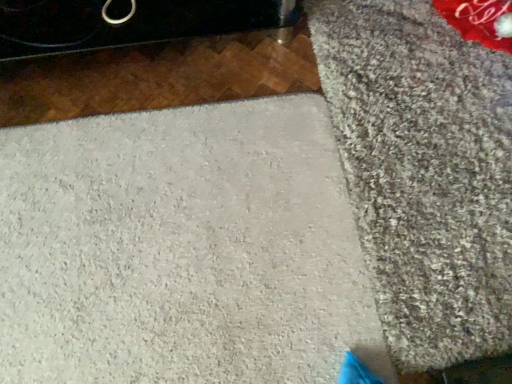
What is the approximate height of white textured concrete at center?

5.38 centimeters.

The width and height of the screenshot is (512, 384). Identify the location of white textured concrete at center. (182, 249).

The height and width of the screenshot is (384, 512). What do you see at coordinates (182, 249) in the screenshot?
I see `white textured concrete at center` at bounding box center [182, 249].

What do you see at coordinates (424, 172) in the screenshot? I see `gray shaggy carpet at right` at bounding box center [424, 172].

This screenshot has height=384, width=512. I want to click on gray shaggy carpet at right, so click(424, 172).

Measure the distance between point [468,139] and camera.

Point [468,139] is 3.77 feet from camera.

Measure the distance between gray shaggy carpet at right and camera.

37.06 inches.

Find the location of a particular element. white textured concrete at center is located at coordinates (182, 249).

Considering the relative positions of white textured concrete at center and gray shaggy carpet at right in the image provided, is white textured concrete at center to the left or to the right of gray shaggy carpet at right?

white textured concrete at center is positioned on gray shaggy carpet at right's left side.

Does white textured concrete at center come in front of gray shaggy carpet at right?

Yes, white textured concrete at center is closer to the camera.

Considering the points (135, 141) and (369, 134), which point is in front, point (135, 141) or point (369, 134)?

The point (369, 134) is more forward.

Consider the image. From the image's perspective, which object appears higher, white textured concrete at center or gray shaggy carpet at right?

From the image's view, gray shaggy carpet at right is above.

From a real-world perspective, does white textured concrete at center sit lower than gray shaggy carpet at right?

Yes.

Can you confirm if white textured concrete at center is wider than gray shaggy carpet at right?

Yes.

Does white textured concrete at center have a lesser height compared to gray shaggy carpet at right?

No, white textured concrete at center is not shorter than gray shaggy carpet at right.

Can you confirm if white textured concrete at center is bigger than gray shaggy carpet at right?

Correct, white textured concrete at center is larger in size than gray shaggy carpet at right.

Would you say white textured concrete at center is outside gray shaggy carpet at right?

Actually, white textured concrete at center is at least partially inside gray shaggy carpet at right.

Is white textured concrete at center placed right next to gray shaggy carpet at right?

white textured concrete at center and gray shaggy carpet at right are not in contact.

Is white textured concrete at center facing away from gray shaggy carpet at right?

No, white textured concrete at center is not facing the opposite direction of gray shaggy carpet at right.

How many degrees apart are the facing directions of white textured concrete at center and gray shaggy carpet at right?

Answer: There is a 89.9-degree angle between the facing directions of white textured concrete at center and gray shaggy carpet at right.

In order to click on concrete below the gray shaggy carpet at right (from the image's perspective) in this screenshot , I will do `click(182, 249)`.

Is gray shaggy carpet at right to the left of white textured concrete at center from the viewer's perspective?

In fact, gray shaggy carpet at right is to the right of white textured concrete at center.

Does gray shaggy carpet at right come in front of white textured concrete at center?

No, gray shaggy carpet at right is further to the viewer.

Is point (479, 325) closer or farther from the camera than point (11, 326)?

Point (479, 325).

From the image's perspective, is gray shaggy carpet at right below white textured concrete at center?

No, from the image's perspective, gray shaggy carpet at right is not beneath white textured concrete at center.

From a real-world perspective, which object rests below the other?

white textured concrete at center, from a real-world perspective.

Between gray shaggy carpet at right and white textured concrete at center, which one has smaller width?

With smaller width is gray shaggy carpet at right.

Does gray shaggy carpet at right have a greater height compared to white textured concrete at center?

No.

Is gray shaggy carpet at right bigger or smaller than white textured concrete at center?

gray shaggy carpet at right is smaller than white textured concrete at center.

Is white textured concrete at center a part of gray shaggy carpet at right?

Yes, white textured concrete at center is surrounded by gray shaggy carpet at right.

Is gray shaggy carpet at right positioned far away from white textured concrete at center?

They are positioned close to each other.

Is gray shaggy carpet at right oriented towards white textured concrete at center?

Yes.

How many degrees apart are the facing directions of gray shaggy carpet at right and white textured concrete at center?

89.9 degrees.

Identify the location of mat behind the white textured concrete at center. The height and width of the screenshot is (384, 512). (424, 172).

Identify the location of concrete below the gray shaggy carpet at right (from the image's perspective). This screenshot has height=384, width=512. (182, 249).

This screenshot has height=384, width=512. What are the coordinates of `mat located behind the white textured concrete at center` in the screenshot? It's located at (424, 172).